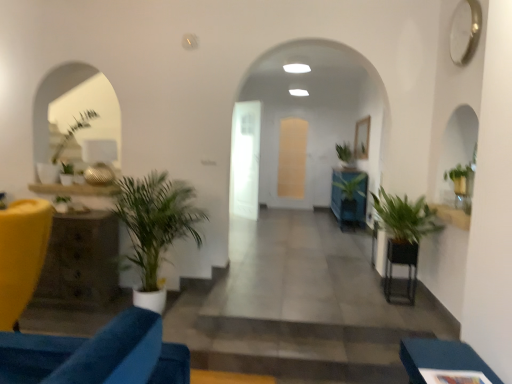
Question: From a real-world perspective, is black metal table at lower right, the first table when ordered from front to back, positioned over rustic wood side table at left, which is the second table in front-to-back order, based on gravity?

Choices:
 (A) yes
 (B) no

Answer: (A)

Question: Is black metal table at lower right, placed as the first table when sorted from right to left, facing towards rustic wood side table at left, which is the second table in front-to-back order?

Choices:
 (A) yes
 (B) no

Answer: (A)

Question: Is black metal table at lower right, placed as the first table when sorted from right to left, located outside rustic wood side table at left, placed as the second table when sorted from right to left?

Choices:
 (A) no
 (B) yes

Answer: (B)

Question: Would you consider black metal table at lower right, the first table when ordered from front to back, to be distant from rustic wood side table at left, which appears as the first table when viewed from the back?

Choices:
 (A) no
 (B) yes

Answer: (B)

Question: Is black metal table at lower right, which ranks as the 2th table in back-to-front order, looking in the opposite direction of rustic wood side table at left, which appears as the first table when viewed from the left?

Choices:
 (A) yes
 (B) no

Answer: (B)

Question: Considering the positions of point (335, 198) and point (410, 344), is point (335, 198) closer or farther from the camera than point (410, 344)?

Choices:
 (A) farther
 (B) closer

Answer: (A)

Question: From the image's perspective, is green glossy plant at center, marked as the 2th houseplant in a back-to-front arrangement, above or below blue fabric ottoman at lower right, positioned as the first furniture in front-to-back order?

Choices:
 (A) above
 (B) below

Answer: (A)

Question: In terms of height, does green glossy plant at center, marked as the 2th houseplant in a back-to-front arrangement, look taller or shorter compared to blue fabric ottoman at lower right, positioned as the first furniture in front-to-back order?

Choices:
 (A) tall
 (B) short

Answer: (A)

Question: Considering the positions of green glossy plant at center, marked as the 2th houseplant in a back-to-front arrangement, and blue fabric ottoman at lower right, which appears as the first furniture when viewed from the right, in the image, is green glossy plant at center, marked as the 2th houseplant in a back-to-front arrangement, wider or thinner than blue fabric ottoman at lower right, which appears as the first furniture when viewed from the right,?

Choices:
 (A) thin
 (B) wide

Answer: (B)

Question: From a real-world perspective, is matte yellow chair at left, positioned as the first furniture in back-to-front order, above or below black metal table at lower right, placed as the first table when sorted from right to left?

Choices:
 (A) below
 (B) above

Answer: (B)

Question: Is matte yellow chair at left, positioned as the first furniture in back-to-front order, in front of or behind black metal table at lower right, placed as the first table when sorted from right to left, in the image?

Choices:
 (A) front
 (B) behind

Answer: (A)

Question: Do you think matte yellow chair at left, positioned as the first furniture in back-to-front order, is within black metal table at lower right, acting as the 2th table starting from the left, or outside of it?

Choices:
 (A) inside
 (B) outside

Answer: (B)

Question: In terms of height, does matte yellow chair at left, positioned as the first furniture in back-to-front order, look taller or shorter compared to black metal table at lower right, placed as the first table when sorted from right to left?

Choices:
 (A) tall
 (B) short

Answer: (A)

Question: From a real-world perspective, relative to green leafy plant at left, which is counted as the 5th houseplant, starting from the right, is green leafy plant at right, the 2th houseplant in the front-to-back sequence, vertically above or below?

Choices:
 (A) above
 (B) below

Answer: (B)

Question: Considering the positions of green leafy plant at right, the 2th houseplant in the front-to-back sequence, and green leafy plant at left, the 4th houseplant viewed from the front, in the image, is green leafy plant at right, the 2th houseplant in the front-to-back sequence, taller or shorter than green leafy plant at left, the 4th houseplant viewed from the front,?

Choices:
 (A) tall
 (B) short

Answer: (A)